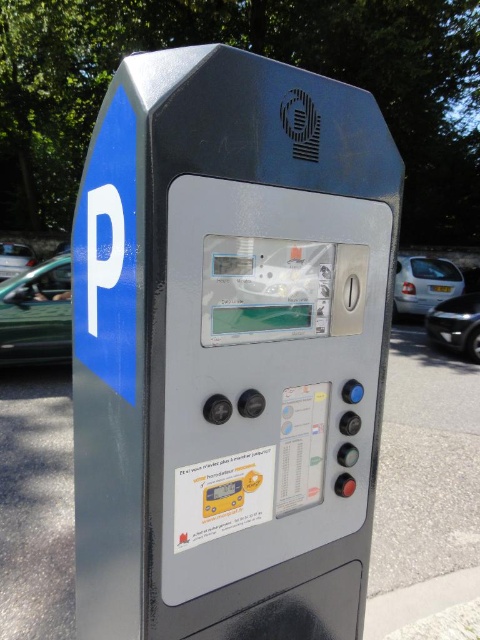
Does metallic parking meter at center have a greater width compared to green matte car at left?

No, metallic parking meter at center is not wider than green matte car at left.

Who is lower down, metallic parking meter at center or green matte car at left?

Positioned lower is metallic parking meter at center.

The width and height of the screenshot is (480, 640). I want to click on metallic parking meter at center, so click(x=229, y=348).

Who is shorter, metallic parking meter at center or white glossy car at right?

white glossy car at right is shorter.

Is point (271, 605) in front of point (419, 305)?

That is True.

Identify the location of metallic parking meter at center. (229, 348).

This screenshot has height=640, width=480. Find the location of `metallic parking meter at center`. metallic parking meter at center is located at coordinates (229, 348).

Can you confirm if metallic parking meter at center is bigger than metallic silver car at left?

Actually, metallic parking meter at center might be smaller than metallic silver car at left.

Is point (266, 634) closer to camera compared to point (8, 252)?

Yes, point (266, 634) is closer to viewer.

Where is `metallic parking meter at center`? metallic parking meter at center is located at coordinates (229, 348).